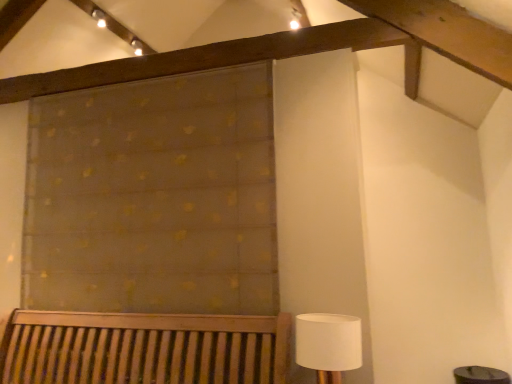
Question: Is translucent gold-patterned curtain at upper center behind white fabric lampshade at lower right?

Choices:
 (A) yes
 (B) no

Answer: (A)

Question: Is translucent gold-patterned curtain at upper center wider than white fabric lampshade at lower right?

Choices:
 (A) yes
 (B) no

Answer: (B)

Question: Is translucent gold-patterned curtain at upper center not near white fabric lampshade at lower right?

Choices:
 (A) no
 (B) yes

Answer: (B)

Question: From a real-world perspective, is translucent gold-patterned curtain at upper center located beneath white fabric lampshade at lower right?

Choices:
 (A) yes
 (B) no

Answer: (B)

Question: From the image's perspective, is translucent gold-patterned curtain at upper center below white fabric lampshade at lower right?

Choices:
 (A) yes
 (B) no

Answer: (B)

Question: From a real-world perspective, is translucent gold-patterned curtain at upper center located higher than white fabric lampshade at lower right?

Choices:
 (A) no
 (B) yes

Answer: (B)

Question: Does white fabric lampshade at lower right come in front of translucent gold-patterned curtain at upper center?

Choices:
 (A) yes
 (B) no

Answer: (A)

Question: Considering the relative sizes of white fabric lampshade at lower right and translucent gold-patterned curtain at upper center in the image provided, is white fabric lampshade at lower right smaller than translucent gold-patterned curtain at upper center?

Choices:
 (A) no
 (B) yes

Answer: (B)

Question: Is white fabric lampshade at lower right at the left side of translucent gold-patterned curtain at upper center?

Choices:
 (A) no
 (B) yes

Answer: (A)

Question: Is white fabric lampshade at lower right behind translucent gold-patterned curtain at upper center?

Choices:
 (A) yes
 (B) no

Answer: (B)

Question: Considering the relative sizes of white fabric lampshade at lower right and translucent gold-patterned curtain at upper center in the image provided, is white fabric lampshade at lower right bigger than translucent gold-patterned curtain at upper center?

Choices:
 (A) yes
 (B) no

Answer: (B)

Question: Would you consider white fabric lampshade at lower right to be distant from translucent gold-patterned curtain at upper center?

Choices:
 (A) no
 (B) yes

Answer: (B)

Question: From a real-world perspective, is white fabric lampshade at lower right positioned above or below translucent gold-patterned curtain at upper center?

Choices:
 (A) above
 (B) below

Answer: (B)